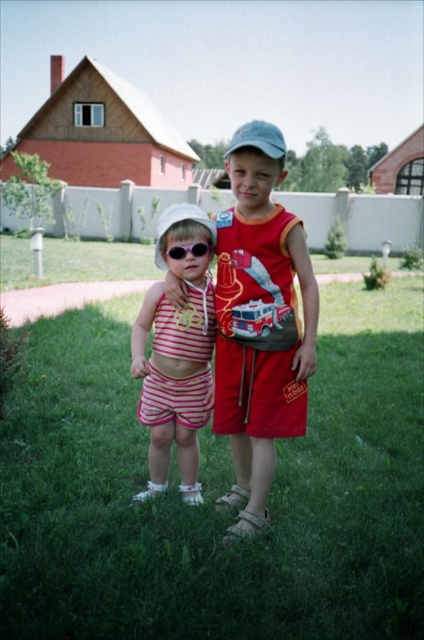
From the picture: You are a photographer taking a picture of the two children. You notice the blue fabric baseball cap at center and the white fabric baseball hat at center. Which one is positioned higher in the image?

The blue fabric baseball cap at center is positioned higher than the white fabric baseball hat at center in the image.

You are a delivery robot with a package that needs to be placed between the matte red shorts at center and the blue fabric baseball cap at center. The minimum distance required for the package placement is 3 feet. Can the package be placed between them?

The matte red shorts at center and blue fabric baseball cap at center are 3.56 feet apart from each other, so yes, the package can be placed between them as the distance is sufficient to meet the 3 feet requirement.

You are standing at the position of the viewer and want to toss a small ball to the matte red shorts at center. What is the approximate distance you need to throw the ball?

The distance between the viewer and the matte red shorts at center is 2.61 meters, so you need to throw the ball approximately 2.61 meters.